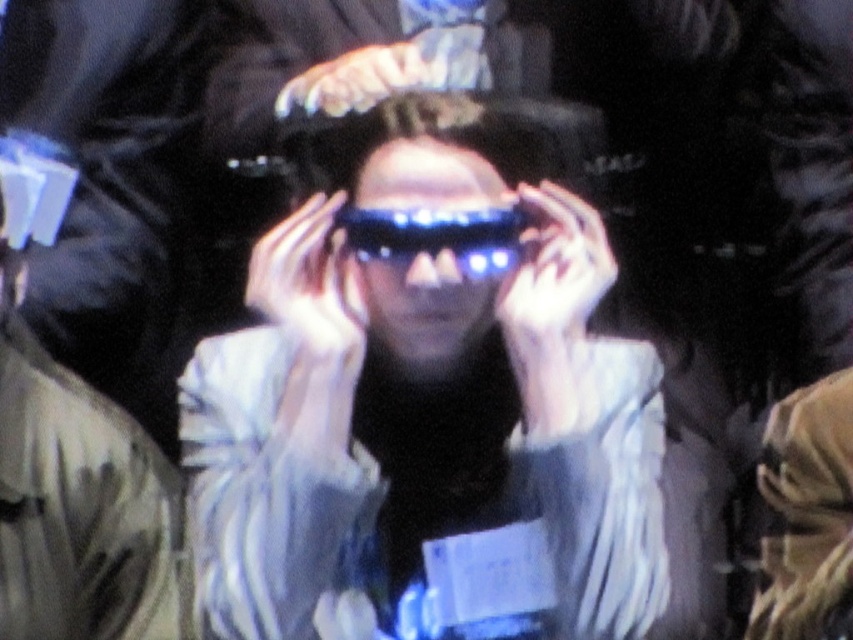
You are standing in a room and want to take a photo of the point at coordinates point (482, 198). The camera you are using has a focal length of 50mm and requires the subject to be at least 3 meters away to avoid blurring. Based on the scene description, can you safely take the photo without blurring?

The point (482, 198) is 2.54 meters from the camera, which is less than the required 3 meters. Therefore, taking the photo might result in blurring.

Based on the scene description, which object is positioned to the right when observing the shiny metallic glasses at center and the blue plastic goggles at center?

The blue plastic goggles at center is positioned to the right of the shiny metallic glasses at center.

You are a technician inspecting the equipment of a participant in a VR setup. You notice two items at the center of your view. Which one is the shiny metallic glasses at center in front of the blue plastic goggles at center?

The shiny metallic glasses at center is closer to the viewer than the blue plastic goggles at center, so the shiny metallic glasses at center is in front of the blue plastic goggles at center.